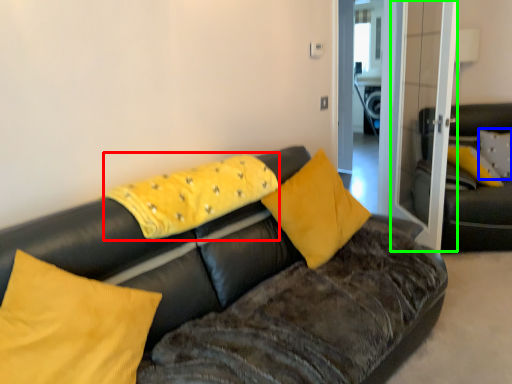
Question: Which object is positioned farthest from pillow (highlighted by a red box)? Select from pillow (highlighted by a blue box) and glass door (highlighted by a green box).

Choices:
 (A) pillow
 (B) glass door

Answer: (A)